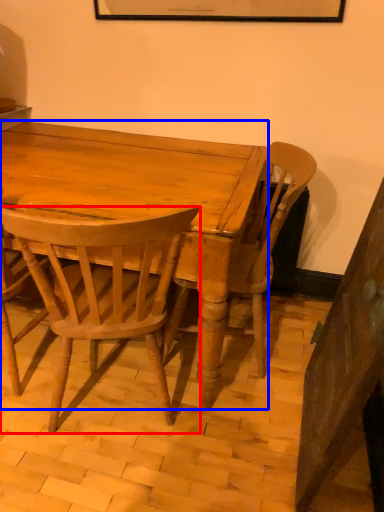
Question: Among these objects, which one is farthest to the camera, chair (highlighted by a red box) or desk (highlighted by a blue box)?

Choices:
 (A) chair
 (B) desk

Answer: (B)